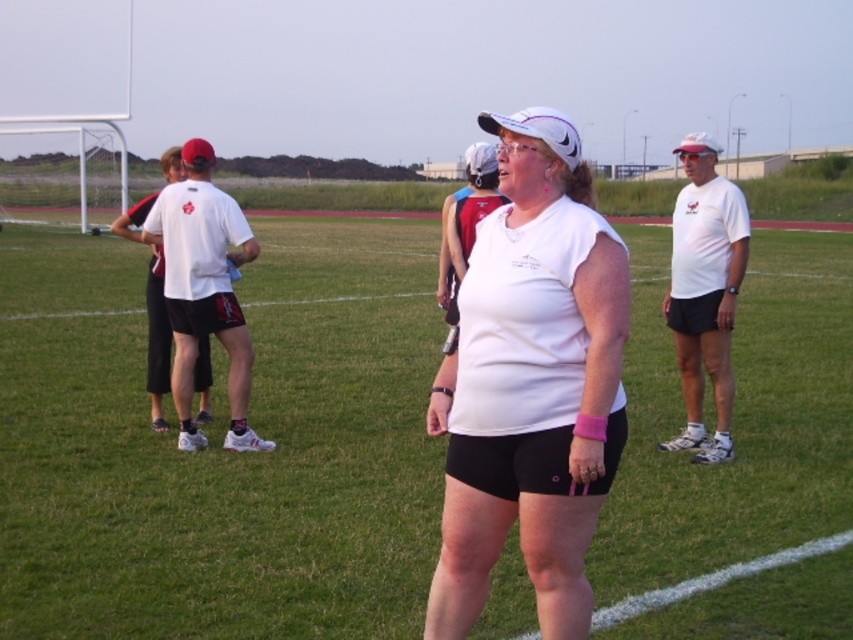
You are standing on the grassy sports field and see two points marked in the image. Which point is closer to you, point (757,636) or point (476,429)?

Point (757,636) is further to the viewer than point (476,429), so point (476,429) is closer to you.